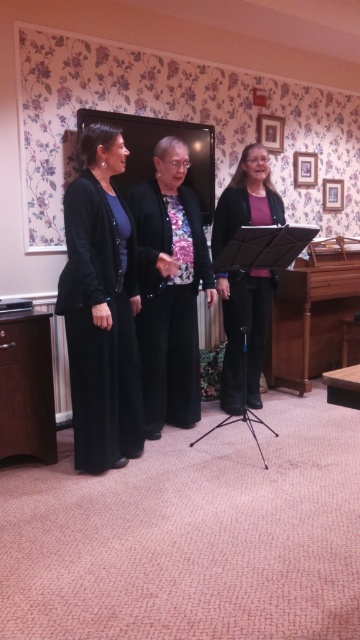
Does black matte suit at left appear on the right side of black matte blazer at center?

No, black matte suit at left is not to the right of black matte blazer at center.

Looking at this image, can you confirm if black matte suit at left is thinner than black matte blazer at center?

Correct, black matte suit at left's width is less than black matte blazer at center's.

Between point (111, 397) and point (192, 387), which one is positioned behind?

The point (192, 387) is more distant.

The image size is (360, 640). What are the coordinates of `black matte suit at left` in the screenshot? It's located at (100, 330).

In the scene shown: Is black matte suit at left closer to the viewer compared to matte black jacket at center?

Answer: Yes, it is.

Does black matte suit at left appear over matte black jacket at center?

No.

Who is more forward, [140,387] or [212,243]?

Point [140,387] is more forward.

I want to click on black matte suit at left, so click(100, 330).

Consider the image. Can you confirm if black matte blazer at center is positioned below matte black jacket at center?

Indeed, black matte blazer at center is positioned under matte black jacket at center.

Is black matte blazer at center to the left of matte black jacket at center from the viewer's perspective?

Indeed, black matte blazer at center is positioned on the left side of matte black jacket at center.

The width and height of the screenshot is (360, 640). What do you see at coordinates (169, 304) in the screenshot?
I see `black matte blazer at center` at bounding box center [169, 304].

Image resolution: width=360 pixels, height=640 pixels. In order to click on black matte blazer at center in this screenshot , I will do `click(169, 304)`.